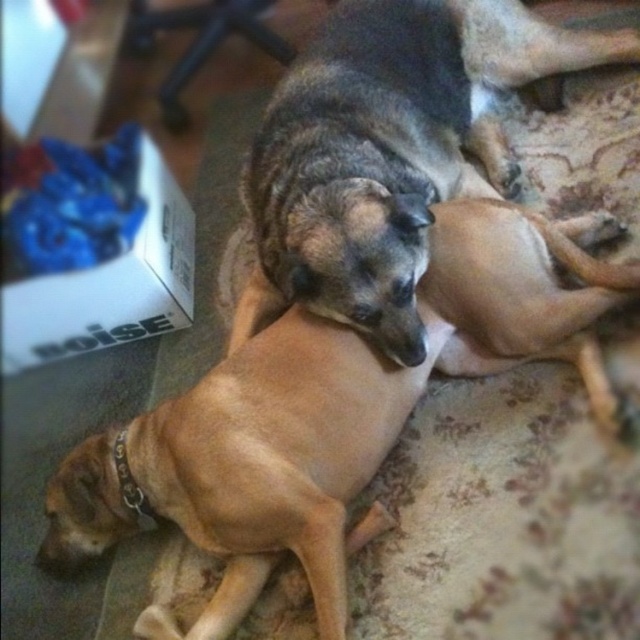
Is point (180, 518) closer to viewer compared to point (548, 67)?

Yes.

Is point (179, 426) farther from viewer compared to point (273, 216)?

No, (179, 426) is closer to viewer.

In order to click on brown smooth dog at lower left in this screenshot , I will do `click(330, 413)`.